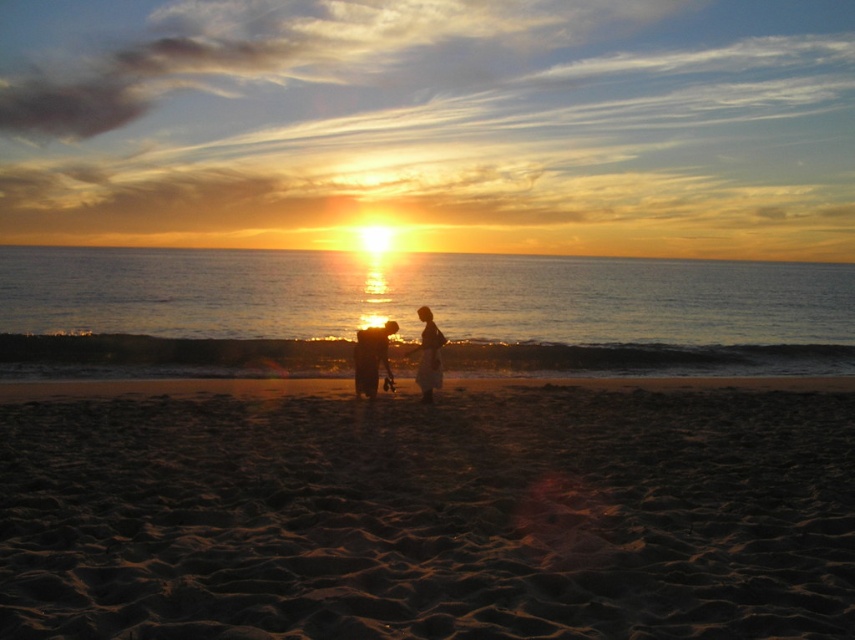
Does dark brown textured sand at center appear under silhouette fabric person at center?

Yes, dark brown textured sand at center is below silhouette fabric person at center.

Can you confirm if dark brown textured sand at center is smaller than silhouette fabric person at center?

No.

Is point (646, 429) positioned after point (438, 364)?

No, (646, 429) is in front of (438, 364).

Image resolution: width=855 pixels, height=640 pixels. I want to click on dark brown textured sand at center, so click(428, 509).

Is point (431, 340) positioned in front of point (419, 348)?

That is True.

You are a GUI agent. You are given a task and a screenshot of the screen. Output one action in this format:
    pyautogui.click(x=<x>, y=<y>)
    Task: Click on the silhouette wooden couple at center
    This screenshot has width=855, height=640.
    Given the screenshot: What is the action you would take?
    pyautogui.click(x=428, y=355)

Where is `silhouette wooden couple at center`? silhouette wooden couple at center is located at coordinates coord(428,355).

Is silhouette sand at center to the right of silhouette fabric person at center from the viewer's perspective?

In fact, silhouette sand at center is to the left of silhouette fabric person at center.

Is silhouette sand at center smaller than silhouette fabric person at center?

Indeed, silhouette sand at center has a smaller size compared to silhouette fabric person at center.

Is point (372, 326) closer to camera compared to point (428, 346)?

No, (372, 326) is behind (428, 346).

The height and width of the screenshot is (640, 855). I want to click on silhouette sand at center, so click(x=370, y=356).